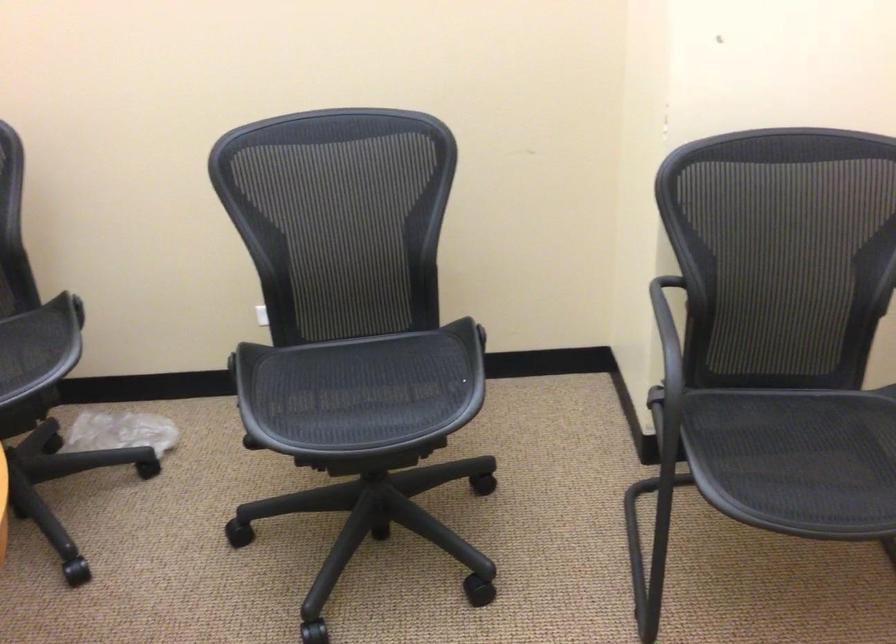
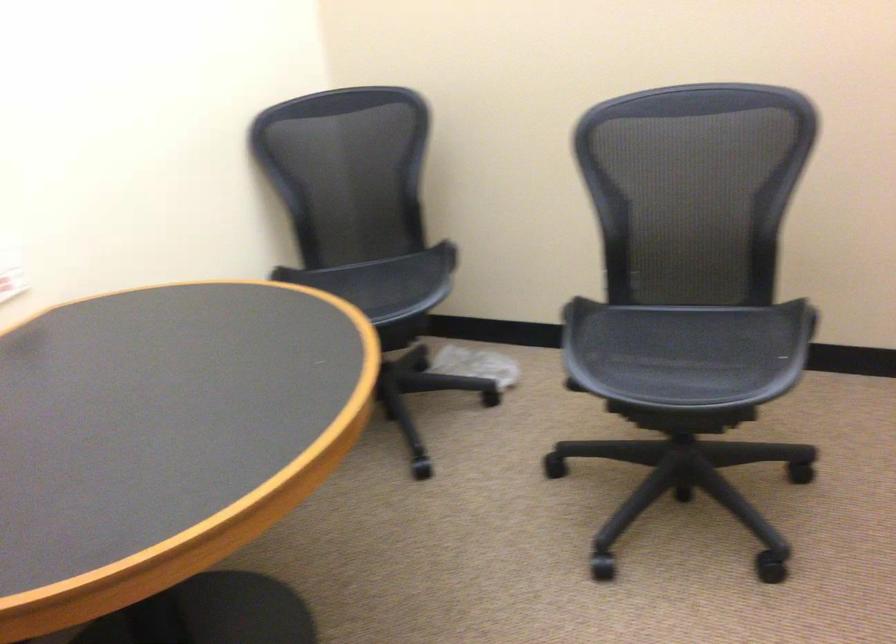
Where in the second image is the point corresponding to [376,391] from the first image?

(686, 352)